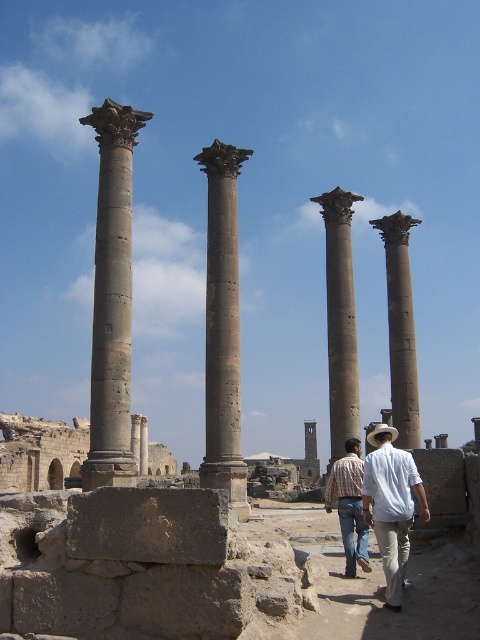
Question: Which object appears farthest from the camera in this image?

Choices:
 (A) white cotton shirt at center
 (B) gray stone column at left

Answer: (B)

Question: Does gray stone column at left have a larger size compared to white cotton shirt at center?

Choices:
 (A) no
 (B) yes

Answer: (B)

Question: Does gray stone column at center have a smaller size compared to dark gray stone arch at center?

Choices:
 (A) yes
 (B) no

Answer: (A)

Question: Considering the real-world distances, which object is closest to the smooth stone column at right?

Choices:
 (A) plaid shirt at center
 (B) gray stone column at center
 (C) white cotton shirt at center
 (D) smooth stone column at center

Answer: (D)

Question: Does smooth stone column at right appear over plaid shirt at center?

Choices:
 (A) no
 (B) yes

Answer: (B)

Question: Which object is positioned closest to the plaid shirt at center?

Choices:
 (A) white cotton shirt at center
 (B) gray stone column at left

Answer: (A)